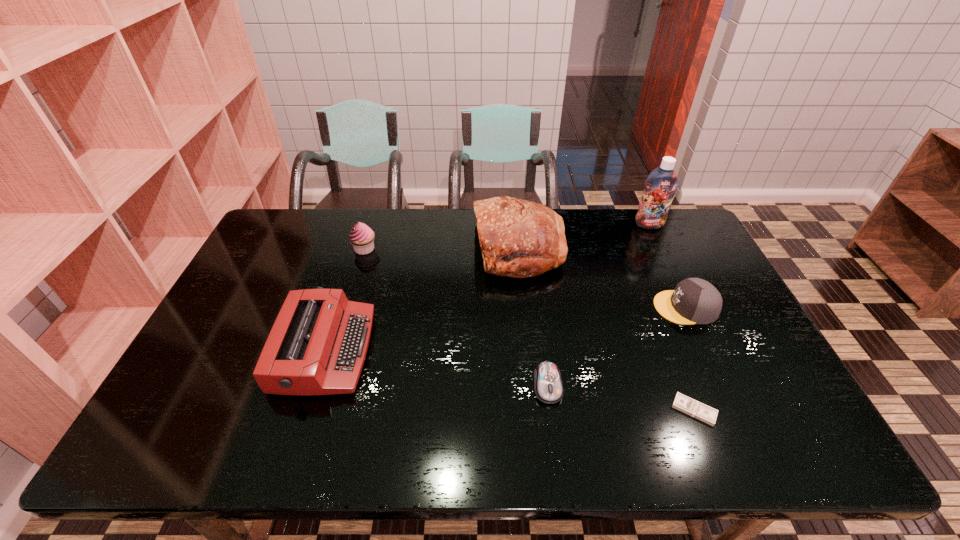
This screenshot has width=960, height=540. In order to click on the tallest object in this screenshot , I will do `click(660, 186)`.

The image size is (960, 540). I want to click on bread, so click(x=518, y=238).

You are a GUI agent. You are given a task and a screenshot of the screen. Output one action in this format:
    pyautogui.click(x=<x>, y=<y>)
    Task: Click on the third tallest object
    
    Given the screenshot: What is the action you would take?
    pyautogui.click(x=361, y=236)

You are a GUI agent. You are given a task and a screenshot of the screen. Output one action in this format:
    pyautogui.click(x=<x>, y=<y>)
    Task: Click on the fourth shortest object
    The height and width of the screenshot is (540, 960).
    Given the screenshot: What is the action you would take?
    pyautogui.click(x=318, y=344)

Where is `cap`? This screenshot has height=540, width=960. cap is located at coordinates (693, 301).

You are a GUI agent. You are given a task and a screenshot of the screen. Output one action in this format:
    pyautogui.click(x=<x>, y=<y>)
    Task: Click on the computer mouse
    The width and height of the screenshot is (960, 540).
    Given the screenshot: What is the action you would take?
    pyautogui.click(x=548, y=387)

Where is `the shortest object`? the shortest object is located at coordinates (696, 409).

This screenshot has width=960, height=540. Identify the location of vacant space located on the front label of the tallest object. (660, 248).

At what (x,y) coordinates should I click in order to perform the action: click on blank space located 0.050m at the sliced front of the sixth shortest object. Please return your answer as a coordinate pair (x, y). Image resolution: width=960 pixels, height=540 pixels. Looking at the image, I should click on (459, 249).

Image resolution: width=960 pixels, height=540 pixels. I want to click on vacant space positioned 0.230m at the sliced front of the sixth shortest object, so click(x=406, y=249).